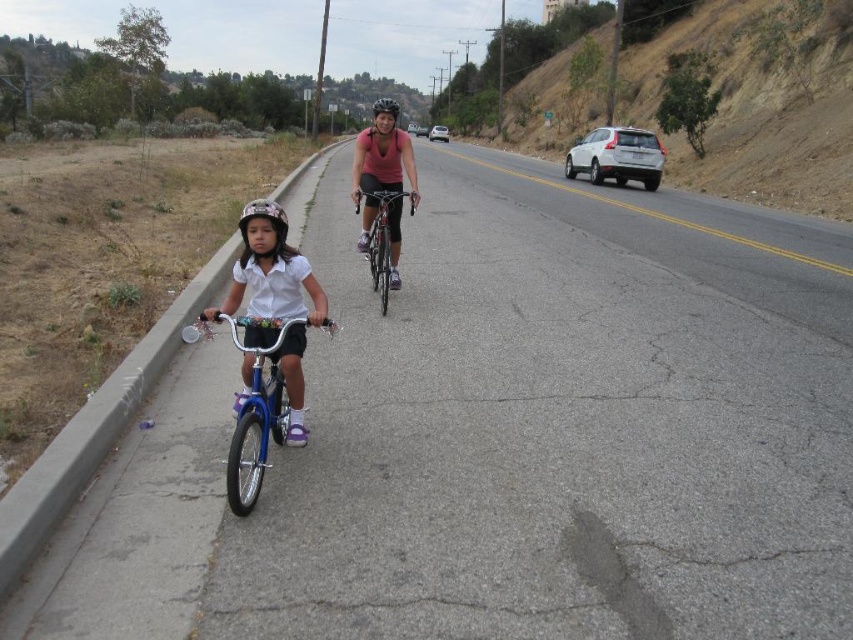
You are standing on the road and see two points marked on the road ahead. The first point is at point (259, 472) and the second is at point (251, 205). Which point is closer to you?

Point (259, 472) is closer to the viewer than point (251, 205).

You are a delivery person who needs to park your shiny metallic bicycle at center near the silver metallic sedan at center. Can you park the bicycle directly next to the sedan without any obstruction?

The shiny metallic bicycle at center is not as tall as the silver metallic sedan at center, so it can be parked directly next to the sedan without any obstruction since height difference won